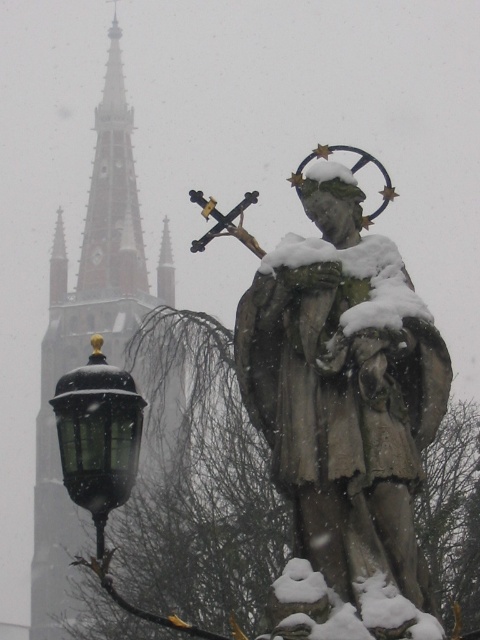
You are standing in the snowy square and want to take a photo of both the brick steeple at upper left and the black glass lamp post at left. Which object should you zoom in on first to ensure both are in frame?

Since the brick steeple at upper left is much taller than the black glass lamp post at left, you should zoom in on the brick steeple at upper left first to ensure its full height fits in the frame while still capturing the black glass lamp post at left.